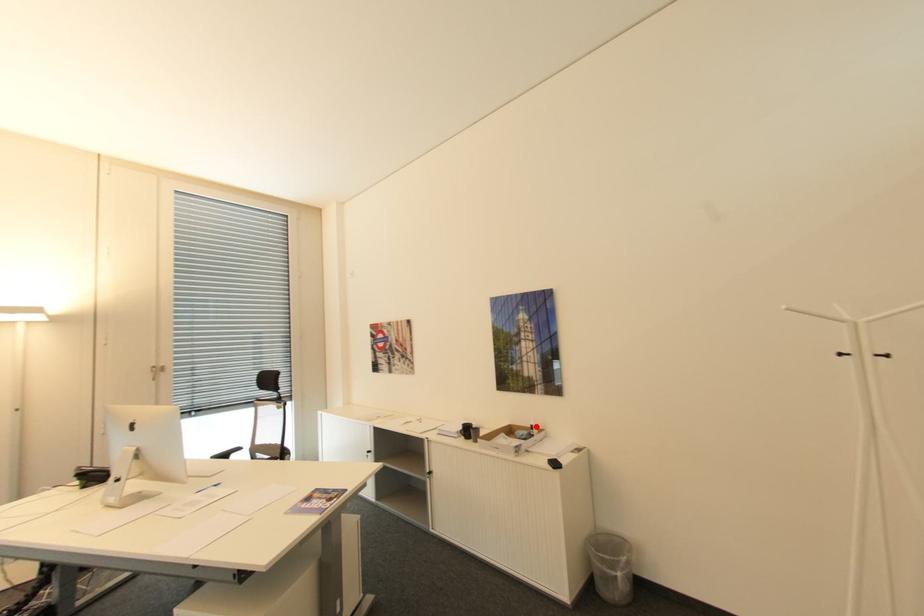
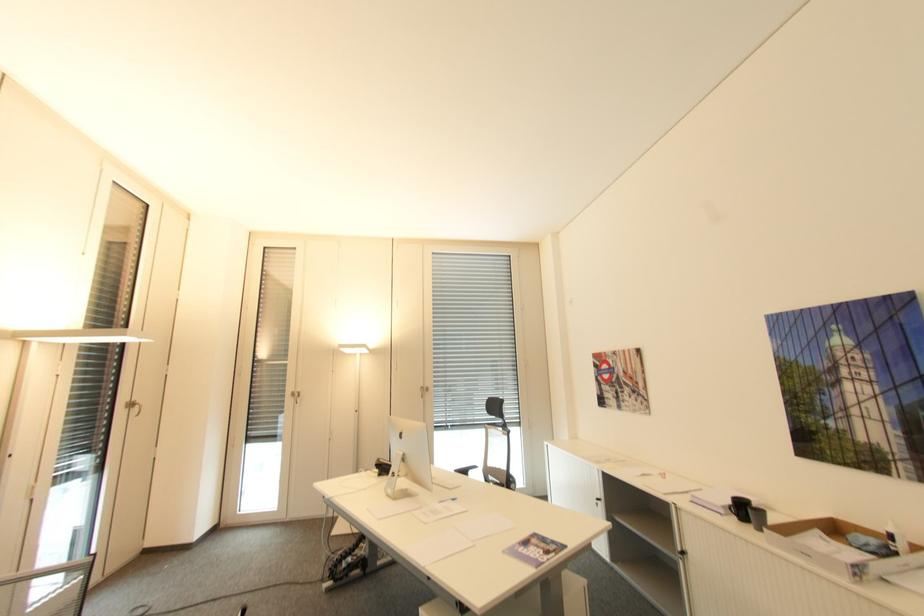
Find the pixel in the second image that matches the highlighted location in the first image.

(895, 537)